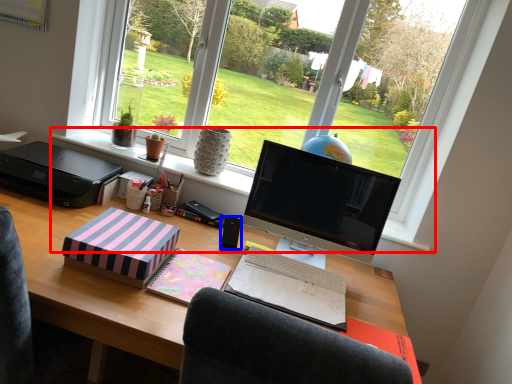
Question: Among these objects, which one is nearest to the camera, window sill (highlighted by a red box) or speaker (highlighted by a blue box)?

Choices:
 (A) window sill
 (B) speaker

Answer: (B)